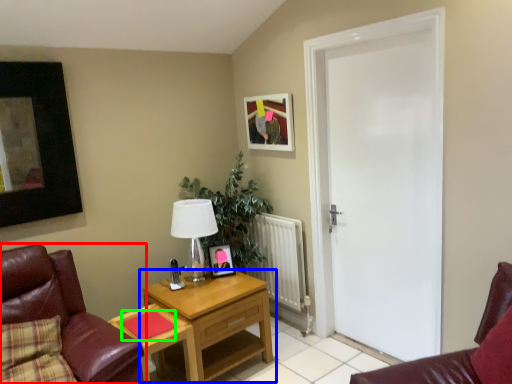
Question: Which object is positioned closest to chair (highlighted by a red box)? Select from nightstand (highlighted by a blue box) and pad (highlighted by a green box).

Choices:
 (A) nightstand
 (B) pad

Answer: (B)